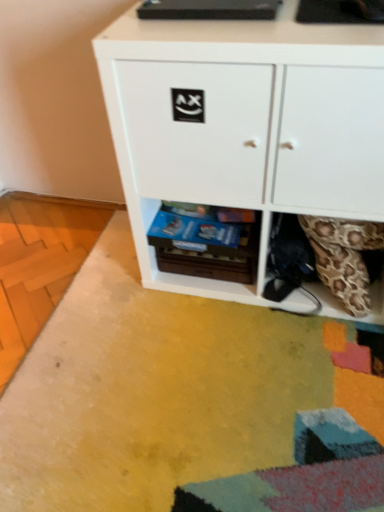
I want to click on free space in front of white matte cabinet at center, so [252, 394].